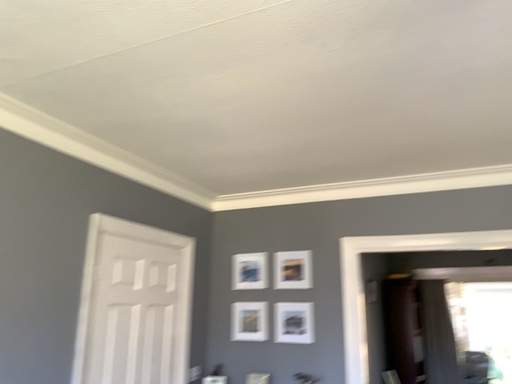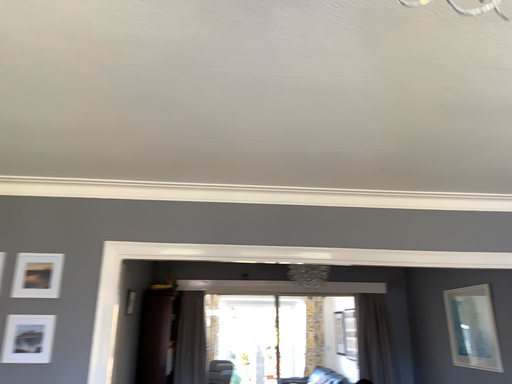
Question: How did the camera likely rotate when shooting the video?

Choices:
 (A) rotated left
 (B) rotated right

Answer: (B)